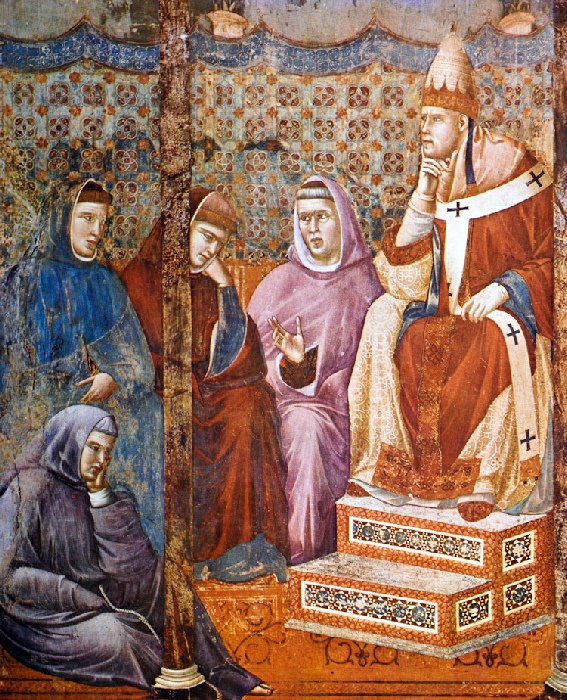
I want to click on pink robe, so click(x=336, y=316).